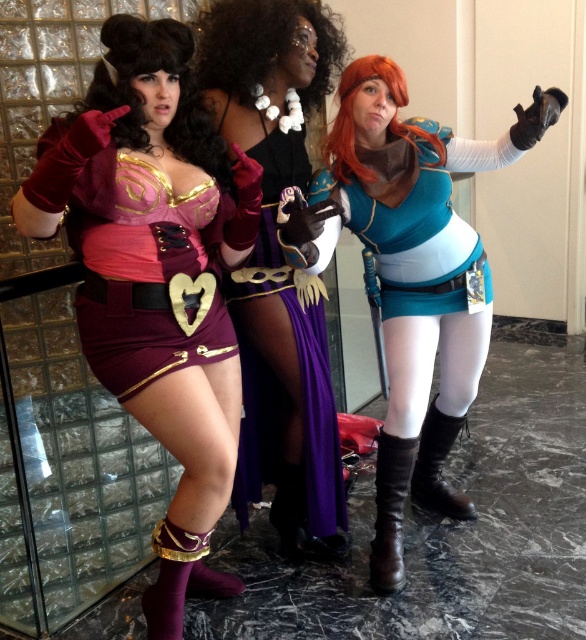
You are a GUI agent. You are given a task and a screenshot of the screen. Output one action in this format:
    pyautogui.click(x=<x>, y=<y>)
    Task: Click on the teal matte armor at center
    This screenshot has height=640, width=586.
    Given the screenshot: What is the action you would take?
    pyautogui.click(x=413, y=280)

This screenshot has width=586, height=640. Describe the element at coordinates (413, 280) in the screenshot. I see `teal matte armor at center` at that location.

Between point (373, 76) and point (209, 550), which one is positioned behind?

Point (373, 76)

At what (x,y) coordinates should I click in order to perform the action: click on teal matte armor at center. Please return your answer as a coordinate pair (x, y). Looking at the image, I should click on (413, 280).

Does orange synthetic wig at right have a greater height compared to brown leather boot at lower right?

In fact, orange synthetic wig at right may be shorter than brown leather boot at lower right.

Which of these two, orange synthetic wig at right or brown leather boot at lower right, stands taller?

Standing taller between the two is brown leather boot at lower right.

Locate an element on the screen. orange synthetic wig at right is located at coordinates (352, 116).

This screenshot has width=586, height=640. I want to click on orange synthetic wig at right, so click(352, 116).

Which of these two, velvet wig at center or brown leather boot at lower center, stands shorter?

velvet wig at center

Where is `velvet wig at center`? This screenshot has width=586, height=640. velvet wig at center is located at coordinates (142, 97).

Locate an element on the screen. velvet wig at center is located at coordinates (142, 97).